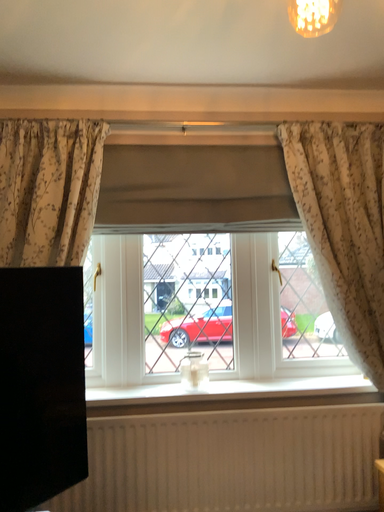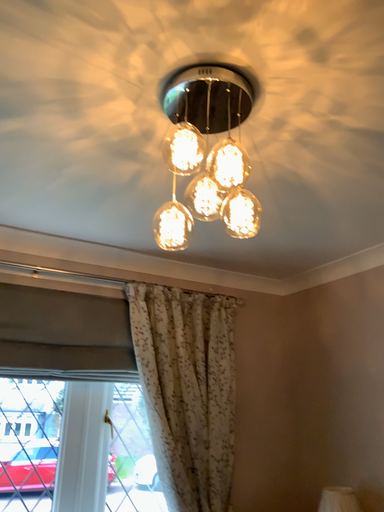
Question: How did the camera likely rotate when shooting the video?

Choices:
 (A) rotated left
 (B) rotated right

Answer: (B)